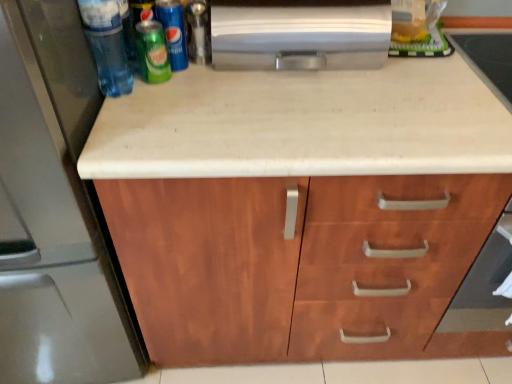
Where is `free spot to the right of green matte soda can at upper left, acting as the first beer starting from the left`? Image resolution: width=512 pixels, height=384 pixels. free spot to the right of green matte soda can at upper left, acting as the first beer starting from the left is located at coordinates (230, 88).